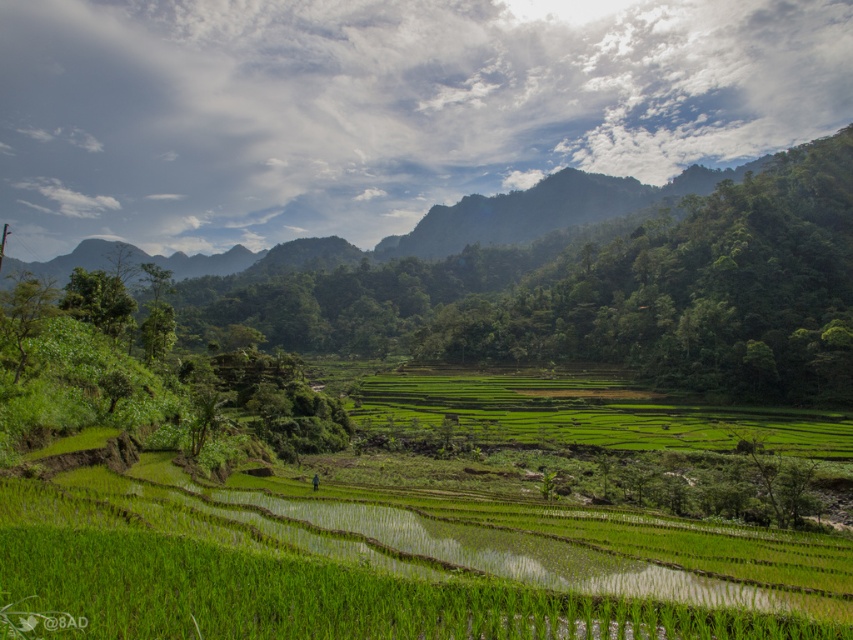
Question: Is green grassy rice field at center smaller than green grassy field at center?

Choices:
 (A) no
 (B) yes

Answer: (B)

Question: Does green grassy rice field at center have a smaller size compared to green grassy field at center?

Choices:
 (A) no
 (B) yes

Answer: (B)

Question: Can you confirm if green grassy rice field at center is positioned above green grassy field at center?

Choices:
 (A) yes
 (B) no

Answer: (A)

Question: Which point is farther from the camera taking this photo?

Choices:
 (A) 155,508
 (B) 381,388

Answer: (B)

Question: Which of the following is the closest to the observer?

Choices:
 (A) green grassy rice field at center
 (B) green grassy field at center

Answer: (A)

Question: Which point is farther to the camera?

Choices:
 (A) (335, 614)
 (B) (587, 412)

Answer: (B)